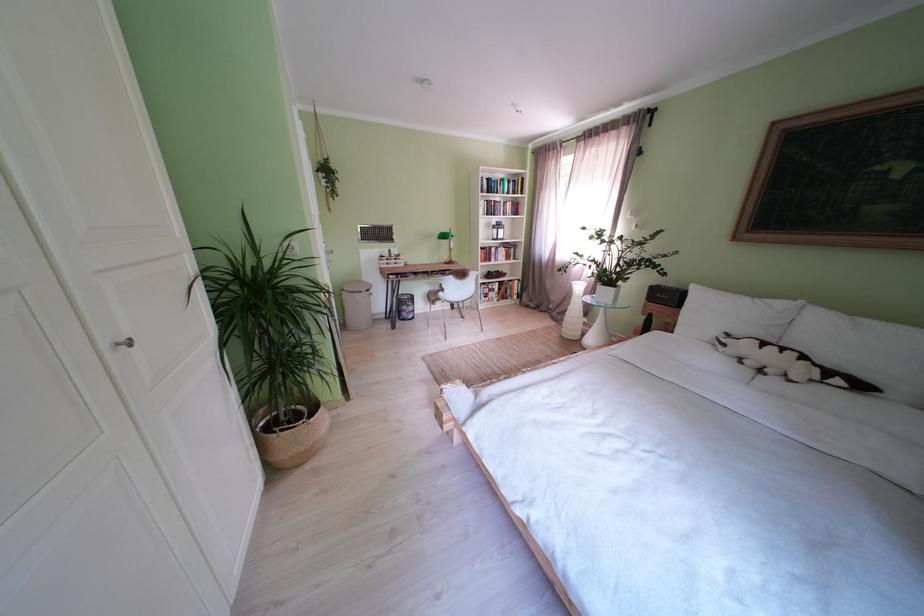
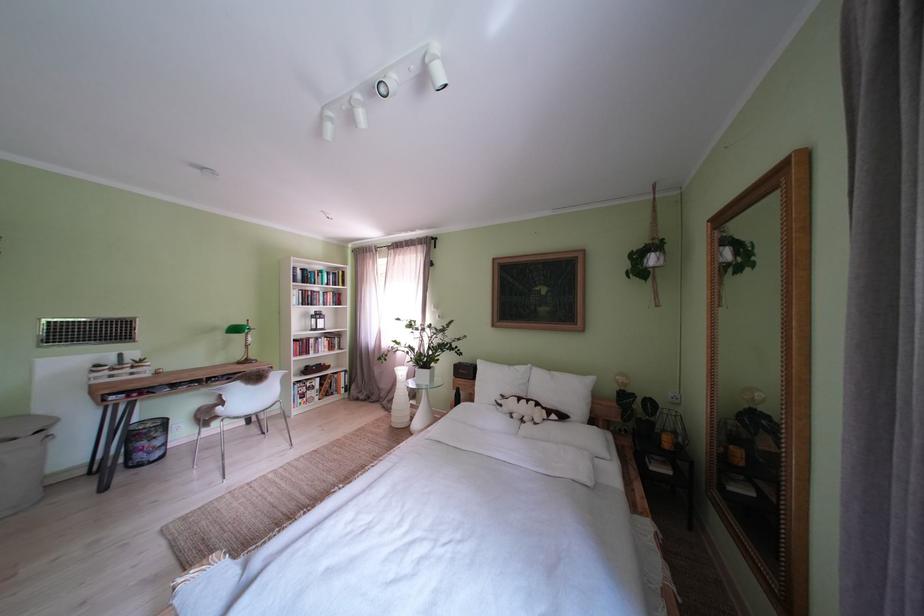
The point at (492,254) is marked in the first image. Where is the corresponding point in the second image?

(307, 346)